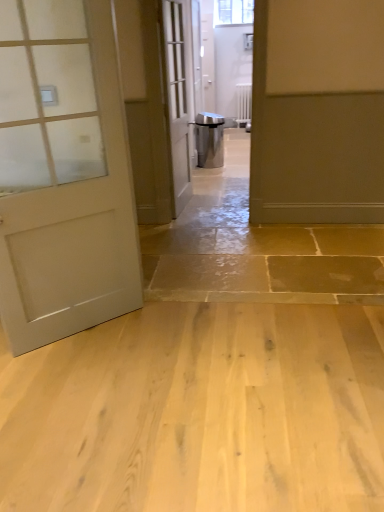
Where is `vacant region above matte gray door at right, which is counted as the 3th door, starting from the left (from a real-world perspective)`? The width and height of the screenshot is (384, 512). vacant region above matte gray door at right, which is counted as the 3th door, starting from the left (from a real-world perspective) is located at coordinates (335, 88).